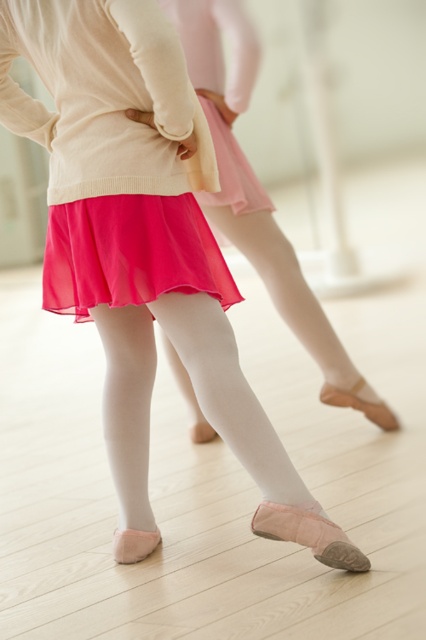
Does pink chiffon skirt at center have a lesser width compared to pink satin ballet slipper at lower center?

In fact, pink chiffon skirt at center might be wider than pink satin ballet slipper at lower center.

Is pink chiffon skirt at center below pink satin ballet slipper at lower center?

Actually, pink chiffon skirt at center is above pink satin ballet slipper at lower center.

This screenshot has height=640, width=426. What do you see at coordinates (259, 195) in the screenshot? I see `pink chiffon skirt at center` at bounding box center [259, 195].

You are a GUI agent. You are given a task and a screenshot of the screen. Output one action in this format:
    pyautogui.click(x=<x>, y=<y>)
    Task: Click on the pink chiffon skirt at center
    
    Given the screenshot: What is the action you would take?
    pyautogui.click(x=259, y=195)

Between shiny chiffon skirt at center and pink satin ballet slipper at lower center, which one appears on the left side from the viewer's perspective?

Positioned to the left is shiny chiffon skirt at center.

Is point (158, 250) positioned after point (288, 522)?

No, (158, 250) is closer to viewer.

What are the coordinates of `shiny chiffon skirt at center` in the screenshot? It's located at (129, 253).

Is point (330, 365) positioned after point (57, 253)?

Yes, point (330, 365) is farther from viewer.

Can you confirm if pink chiffon skirt at center is shorter than shiny chiffon skirt at center?

No, pink chiffon skirt at center is not shorter than shiny chiffon skirt at center.

Is point (281, 268) positioned behind point (103, 243)?

Yes, point (281, 268) is behind point (103, 243).

You are a GUI agent. You are given a task and a screenshot of the screen. Output one action in this format:
    pyautogui.click(x=<x>, y=<y>)
    Task: Click on the pink chiffon skirt at center
    
    Given the screenshot: What is the action you would take?
    pyautogui.click(x=259, y=195)